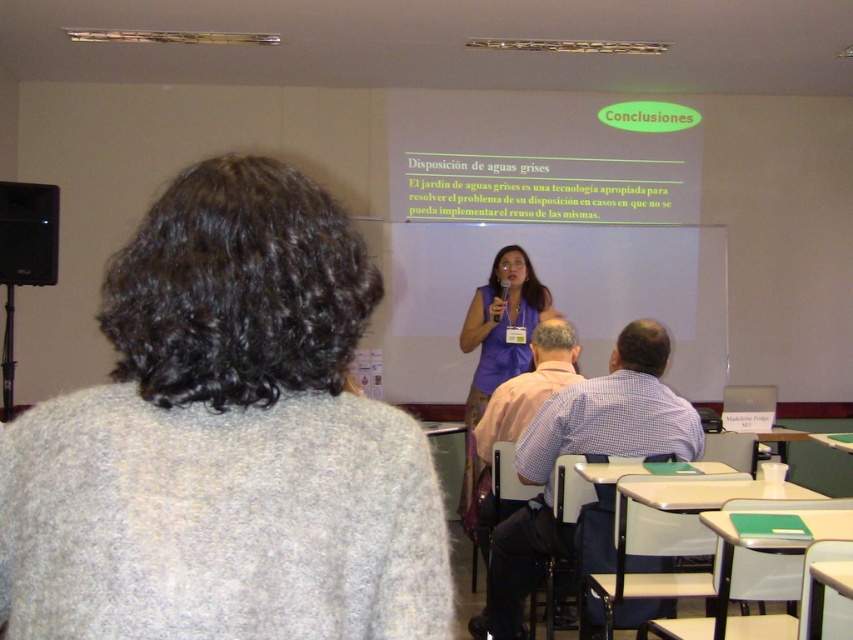
Is checkered fabric shirt at center smaller than purple fabric dress at center?

No, checkered fabric shirt at center is not smaller than purple fabric dress at center.

Is point (608, 369) positioned before point (480, 500)?

No.

Identify the location of checkered fabric shirt at center. [x=583, y=452].

Is checkered fabric shirt at center wider than black matte speaker at left?

Indeed, checkered fabric shirt at center has a greater width compared to black matte speaker at left.

Can you confirm if checkered fabric shirt at center is positioned below black matte speaker at left?

Indeed, checkered fabric shirt at center is positioned under black matte speaker at left.

Describe the element at coordinates (583, 452) in the screenshot. I see `checkered fabric shirt at center` at that location.

Where is `checkered fabric shirt at center`? The width and height of the screenshot is (853, 640). checkered fabric shirt at center is located at coordinates (583, 452).

Measure the distance between gray woolen sweater at upper left and checkered fabric shirt at center.

They are 7.62 feet apart.

Is point (82, 528) positioned in front of point (636, 362)?

Yes, it is.

At what (x,y) coordinates should I click in order to perform the action: click on gray woolen sweater at upper left. Please return your answer as a coordinate pair (x, y). This screenshot has height=640, width=853. Looking at the image, I should click on (225, 442).